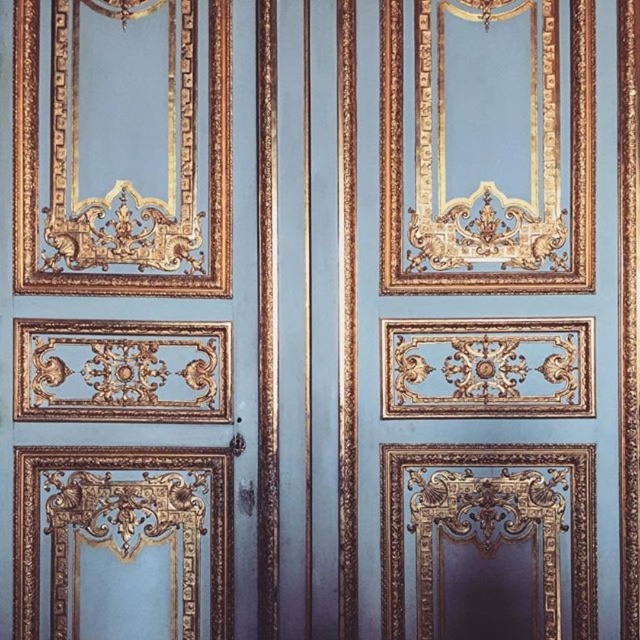
From the picture: You are an interior designer assessing the wall with two doors. The gold metallic door at center and the matte gold door at center are both in the same location. Which door takes up more space on the wall?

The gold metallic door at center is bigger than the matte gold door at center, so it takes up more space on the wall.

From the picture: You are standing in front of two doors in the ornate wall. The gold metallic door at center and the matte gold door at center are both in front of you. Which door is positioned to the right side?

The gold metallic door at center is positioned to the right of the matte gold door at center.